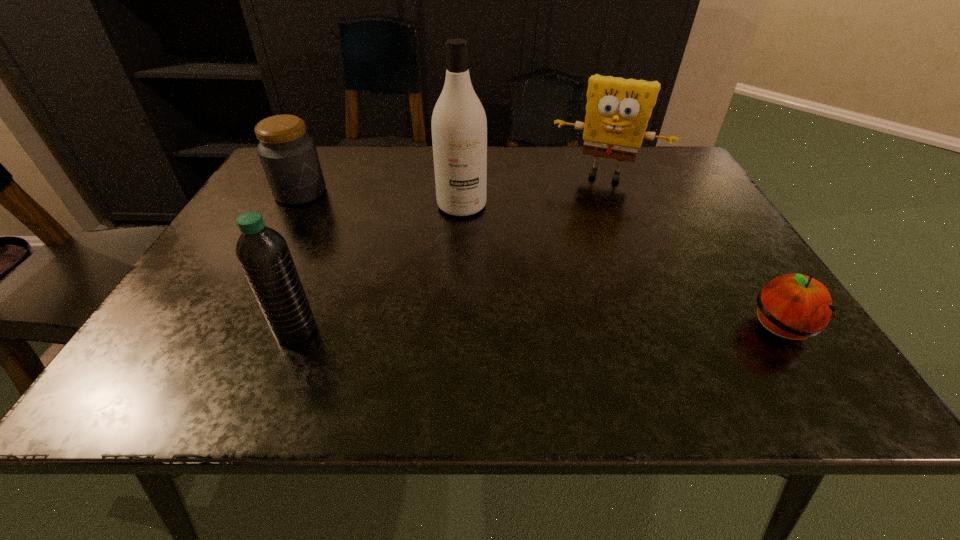
The height and width of the screenshot is (540, 960). Identify the location of empty location between the tallest object and the leftmost object. (381, 199).

The height and width of the screenshot is (540, 960). Find the location of `free space between the shampoo and the fourth tallest object`. free space between the shampoo and the fourth tallest object is located at coordinates (381, 199).

What are the coordinates of `vacant region between the second object from left to right and the fourth object from left to right` in the screenshot? It's located at (450, 253).

Find the location of a particular element. The width and height of the screenshot is (960, 540). free space between the sponge and the water bottle is located at coordinates (450, 253).

Identify the location of free spot between the tallest object and the water bottle. The height and width of the screenshot is (540, 960). (379, 268).

You are a GUI agent. You are given a task and a screenshot of the screen. Output one action in this format:
    pyautogui.click(x=<x>, y=<y>)
    Task: Click on the object identified as the fourth closest to the jar
    The height and width of the screenshot is (540, 960).
    Given the screenshot: What is the action you would take?
    pyautogui.click(x=794, y=306)

The width and height of the screenshot is (960, 540). I want to click on object identified as the second closest to the apple, so click(459, 126).

Find the location of a particular element. The height and width of the screenshot is (540, 960). vacant area that satisfies the following two spatial constraints: 1. on the back side of the apple; 2. on the right side of the water bottle is located at coordinates (298, 329).

Locate an element on the screen. The image size is (960, 540). vacant region that satisfies the following two spatial constraints: 1. on the front side of the leftmost object; 2. on the left side of the second object from left to right is located at coordinates (225, 331).

At what (x,y) coordinates should I click in order to perform the action: click on vacant point that satisfies the following two spatial constraints: 1. on the front side of the rightmost object; 2. on the left side of the jar. Please return your answer as a coordinate pair (x, y). Looking at the image, I should click on (226, 329).